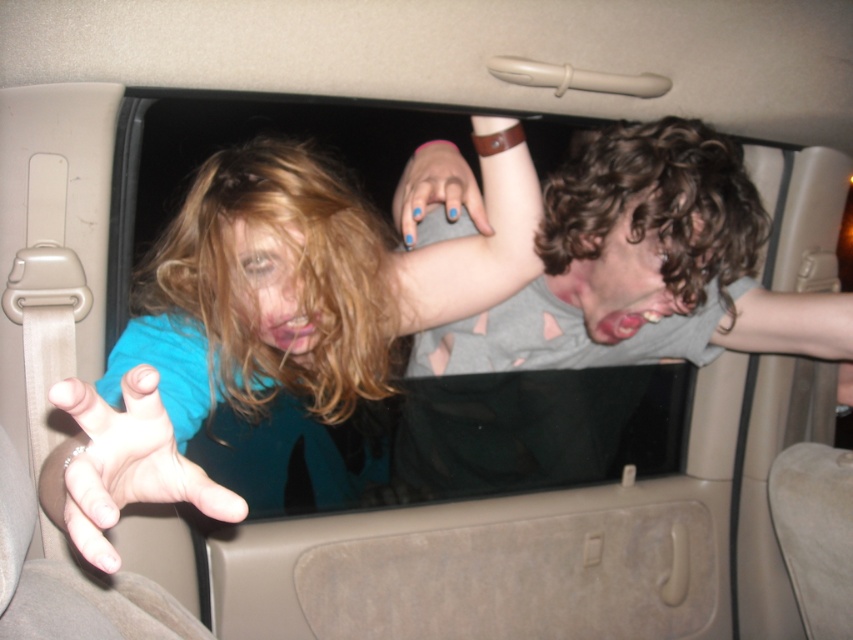
Question: Among these points, which one is farthest from the camera?

Choices:
 (A) (721, 257)
 (B) (450, 173)

Answer: (B)

Question: Considering the relative positions of gray matte shirt at upper right and light blue fabric hand at center in the image provided, where is gray matte shirt at upper right located with respect to light blue fabric hand at center?

Choices:
 (A) right
 (B) left

Answer: (A)

Question: Can you confirm if gray matte shirt at upper right is wider than blue matte shirt at left?

Choices:
 (A) no
 (B) yes

Answer: (B)

Question: Can you confirm if blue matte shirt at left is thinner than blue painted nails at upper center?

Choices:
 (A) no
 (B) yes

Answer: (A)

Question: Among these objects, which one is farthest from the camera?

Choices:
 (A) blue matte shirt at left
 (B) light blue fabric hand at center
 (C) gray matte shirt at upper right
 (D) blue painted nails at upper center

Answer: (C)

Question: Which is nearer to the blue matte shirt at left?

Choices:
 (A) gray matte shirt at upper right
 (B) blue painted nails at upper center
 (C) light blue fabric hand at center

Answer: (B)